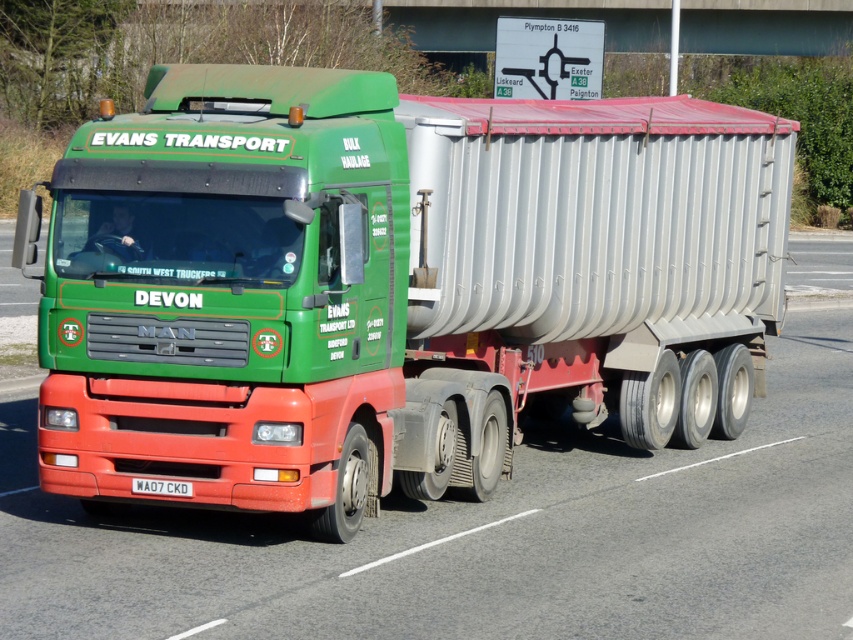
You are standing on the roadside and see the green matte truck at center. If you want to cross the road to reach the truck, and the road is 8 meters wide, can you safely reach the truck without stepping into the road?

The green matte truck at center is 8.40 meters away from the viewer. Since the road is 8 meters wide, the distance to the truck is slightly more than the road width. Therefore, you can safely cross the road to reach the truck without stepping into the road beyond its width.

You are a driver who just noticed the white plastic license plate at center and the green matte truck at center in your rearview mirror. Which one is positioned more to the right from your perspective?

The green matte truck at center is positioned to the right of the white plastic license plate at center, so the green matte truck at center is more to the right.